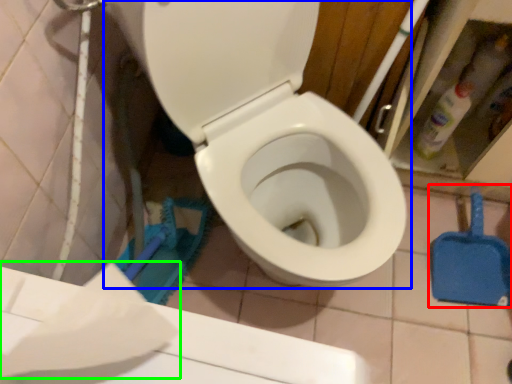
Question: Based on their relative distances, which object is nearer to shovel (highlighted by a red box)? Choose from toilet (highlighted by a blue box) and toilet paper (highlighted by a green box).

Choices:
 (A) toilet
 (B) toilet paper

Answer: (A)